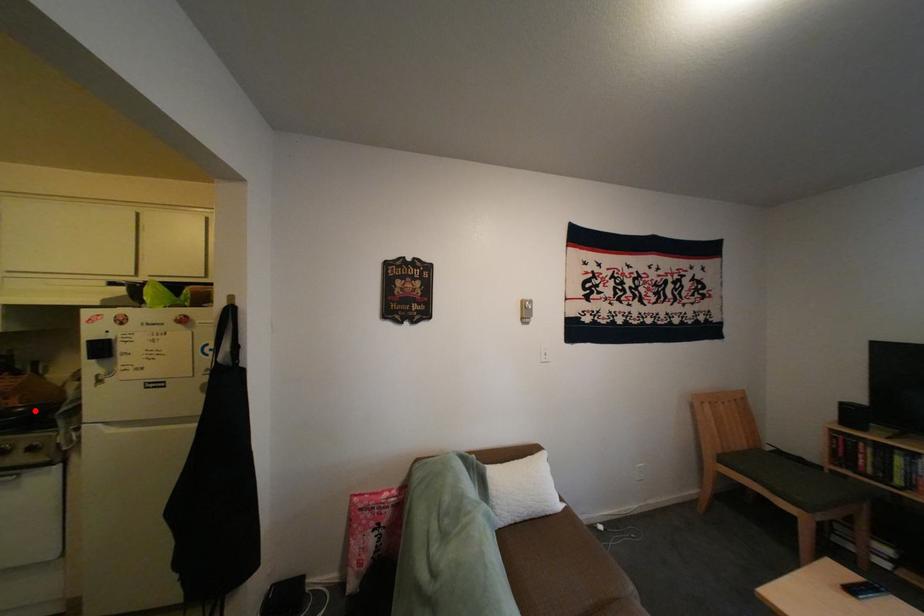
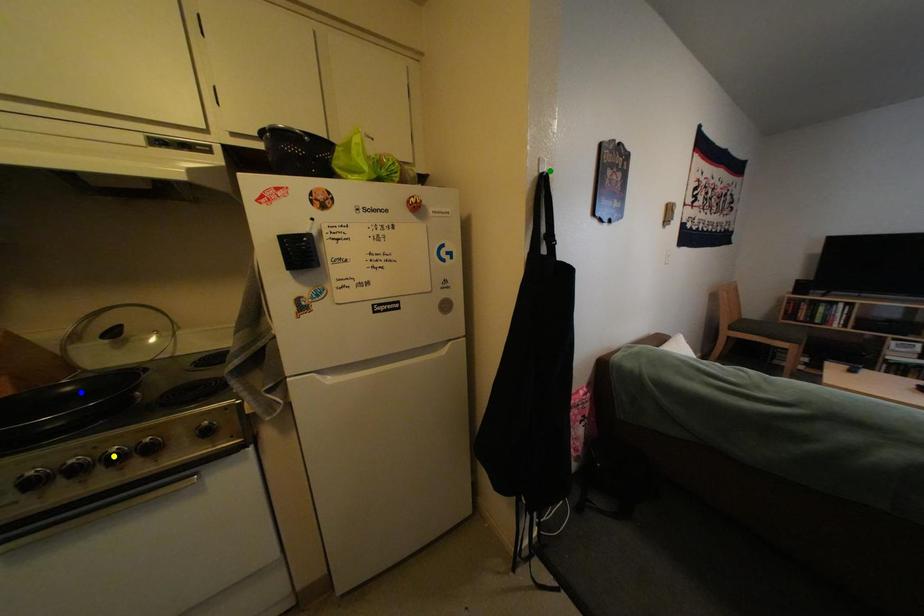
Question: I am providing you with two images of the same scene from different viewpoints. A red point is marked on the first image. You are given multiple points on the second image. Which mark in image 2 goes with the point in image 1?

Choices:
 (A) yellow point
 (B) green point
 (C) blue point

Answer: (C)